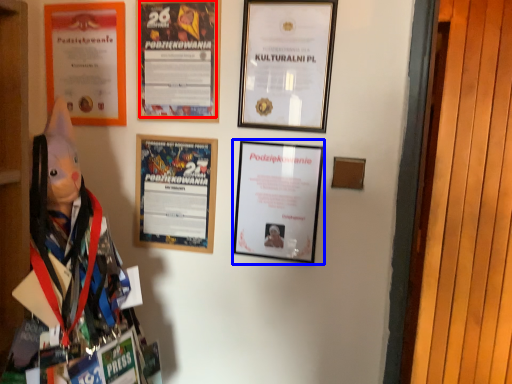
Question: Which of the following is the closest to the observer, poster (highlighted by a red box) or picture frame (highlighted by a blue box)?

Choices:
 (A) poster
 (B) picture frame

Answer: (B)